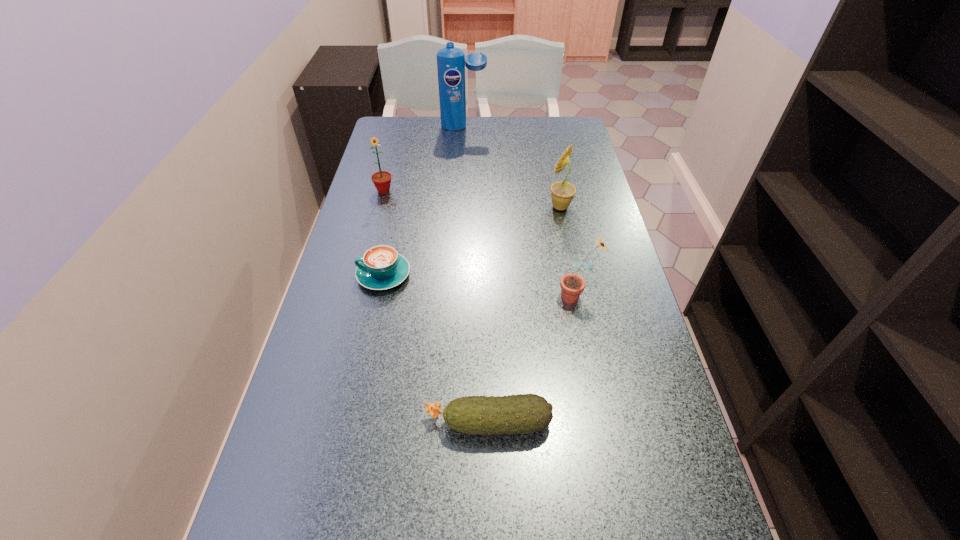
The height and width of the screenshot is (540, 960). I want to click on vacant space positioned on the face of the second nearest sunflower, so click(488, 207).

Where is `vacant space located on the face of the second nearest sunflower`? The height and width of the screenshot is (540, 960). vacant space located on the face of the second nearest sunflower is located at coordinates (451, 207).

Where is `vacant space located on the face of the fifth nearest object`? vacant space located on the face of the fifth nearest object is located at coordinates (369, 248).

Identify the location of vacant area situated 0.090m on the flower of the nearest sunflower. The width and height of the screenshot is (960, 540). (521, 296).

Find the location of a particular element. Image resolution: width=960 pixels, height=540 pixels. vacant space located 0.260m on the flower of the nearest sunflower is located at coordinates (452, 296).

This screenshot has height=540, width=960. In order to click on free spot located 0.170m on the flower of the nearest sunflower in this screenshot , I will do `click(489, 296)`.

Find the location of `vacant space located 0.260m at the blossom end of the cucumber`. vacant space located 0.260m at the blossom end of the cucumber is located at coordinates (292, 423).

Identify the location of vacant region located at the blossom end of the cucumber. The image size is (960, 540). (327, 423).

This screenshot has height=540, width=960. Find the location of `free space located at the blossom end of the cucumber`. free space located at the blossom end of the cucumber is located at coordinates click(x=374, y=423).

The width and height of the screenshot is (960, 540). I want to click on object present at the far edge, so click(451, 61).